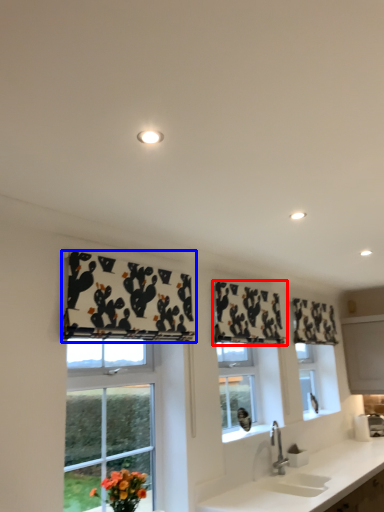
Question: Which object appears closest to the camera in this image, curtain (highlighted by a red box) or curtain (highlighted by a blue box)?

Choices:
 (A) curtain
 (B) curtain

Answer: (B)